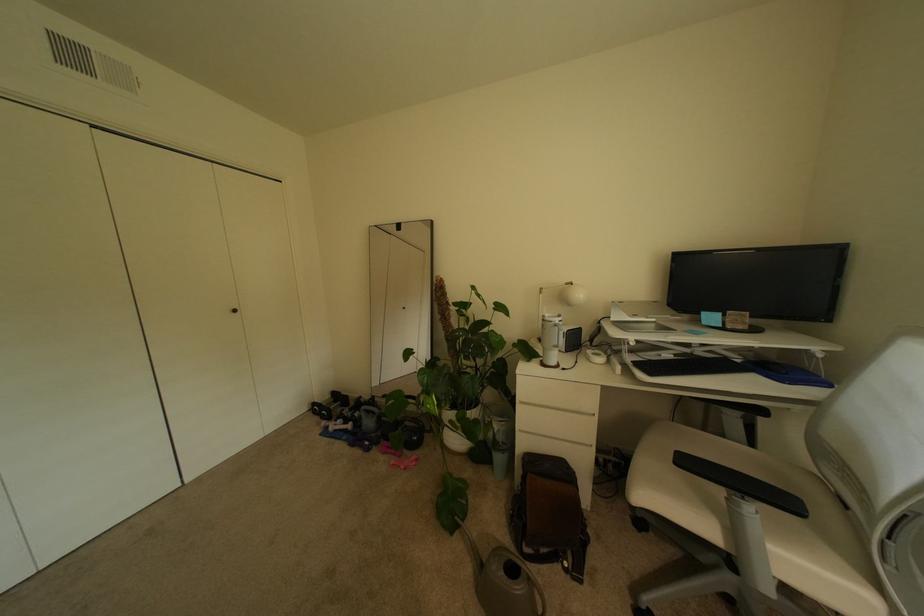
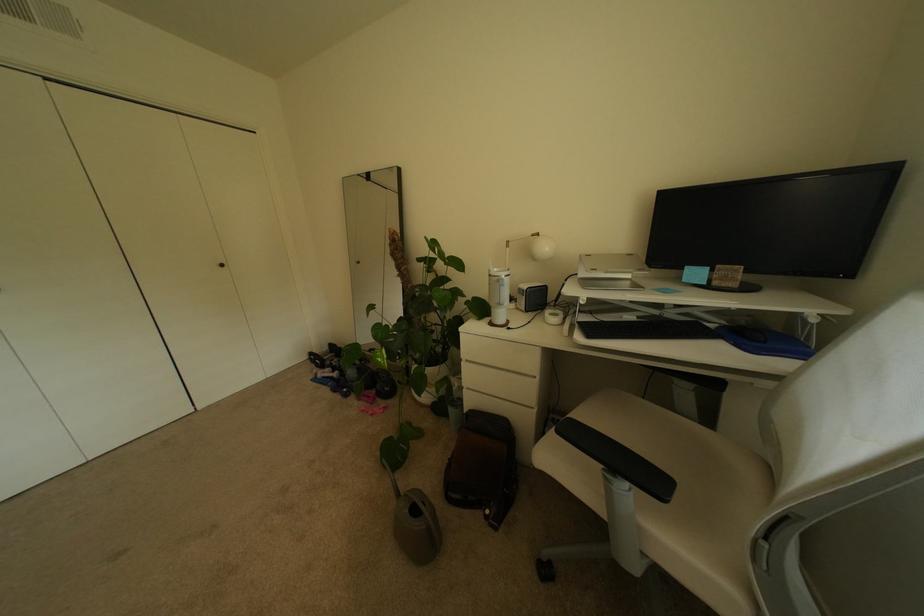
Locate, in the second image, the point that corresponds to (354,431) in the first image.

(341, 379)